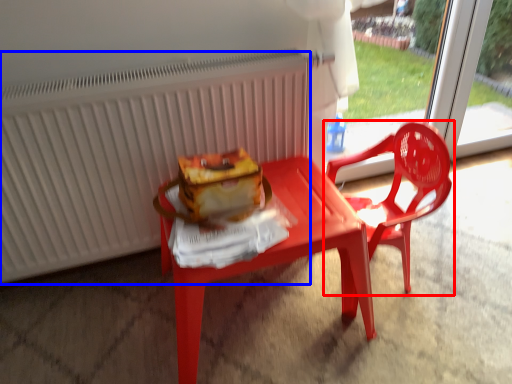
Question: Which point is further to the camera, chair (highlighted by a red box) or radiator (highlighted by a blue box)?

Choices:
 (A) chair
 (B) radiator

Answer: (A)